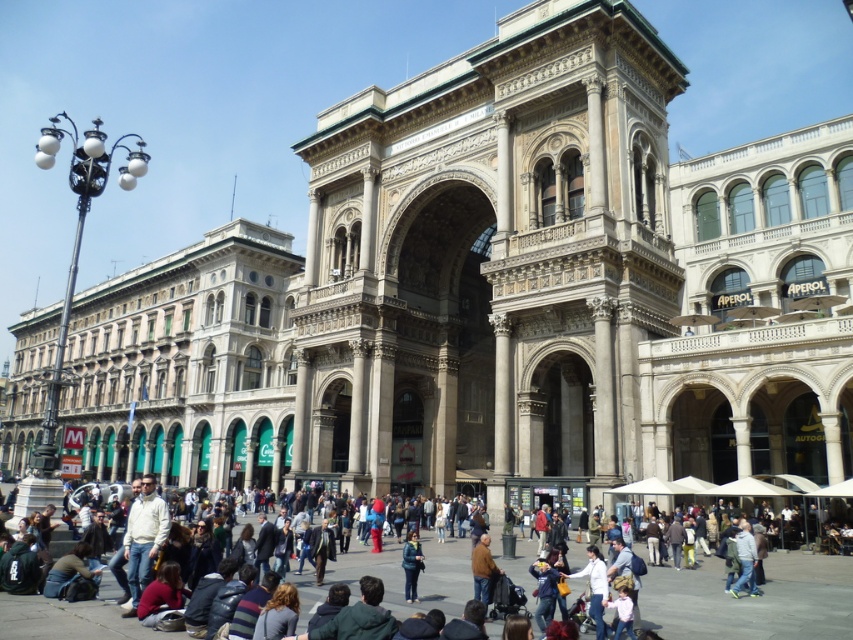
You are a fashion designer observing an urban scene with a grand historic building. You notice two jackets in the crowd. Which jacket is positioned to the right of the other? The jackets are the blue denim jacket at center and the white matte jacket at lower left.

The blue denim jacket at center is positioned to the right of the white matte jacket at lower left.

What are the coordinates of the blue denim jacket at center?

The blue denim jacket at center is located at coordinates point [752,600].